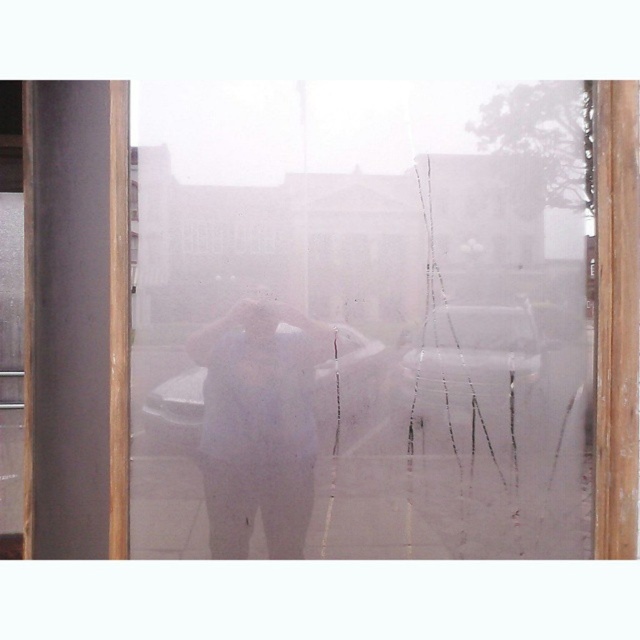
Question: From the image, what is the correct spatial relationship of metallic silver car at center in relation to white matte car at center?

Choices:
 (A) right
 (B) left

Answer: (A)

Question: Can you confirm if white matte shirt at center is positioned below metallic silver car at center?

Choices:
 (A) no
 (B) yes

Answer: (B)

Question: Which is farther from the white matte car at center?

Choices:
 (A) metallic silver car at center
 (B) white matte shirt at center
 (C) frosted glass door at center

Answer: (A)

Question: Does frosted glass door at center have a smaller size compared to metallic silver car at center?

Choices:
 (A) yes
 (B) no

Answer: (B)

Question: Which point is closer to the camera?

Choices:
 (A) frosted glass door at center
 (B) white matte shirt at center
 (C) white matte car at center
 (D) metallic silver car at center

Answer: (A)

Question: Which point is closer to the camera?

Choices:
 (A) (307, 435)
 (B) (364, 378)
 (C) (428, 333)

Answer: (A)